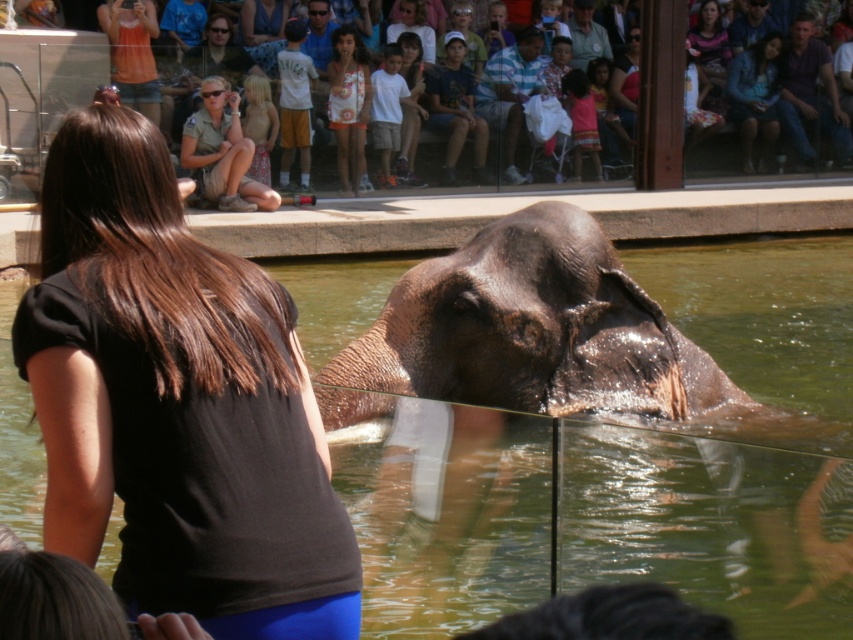
Question: Can you confirm if green liquid water at elephant front is positioned to the right of black fabric shirt at center?

Choices:
 (A) no
 (B) yes

Answer: (A)

Question: Which of these objects is positioned closest to the black fabric shirt at center?

Choices:
 (A) dark brown wrinkled skin elephant at center
 (B) green liquid water at elephant front

Answer: (B)

Question: Observing the image, what is the correct spatial positioning of green liquid water at elephant front in reference to black fabric shirt at center?

Choices:
 (A) right
 (B) left

Answer: (B)

Question: Considering the real-world distances, which object is closest to the dark brown wrinkled skin elephant at center?

Choices:
 (A) green liquid water at elephant front
 (B) black fabric shirt at center

Answer: (A)

Question: Which point is closer to the camera taking this photo?

Choices:
 (A) (834, 413)
 (B) (508, 285)

Answer: (B)

Question: Is black fabric shirt at center closer to camera compared to dark brown wrinkled skin elephant at center?

Choices:
 (A) no
 (B) yes

Answer: (B)